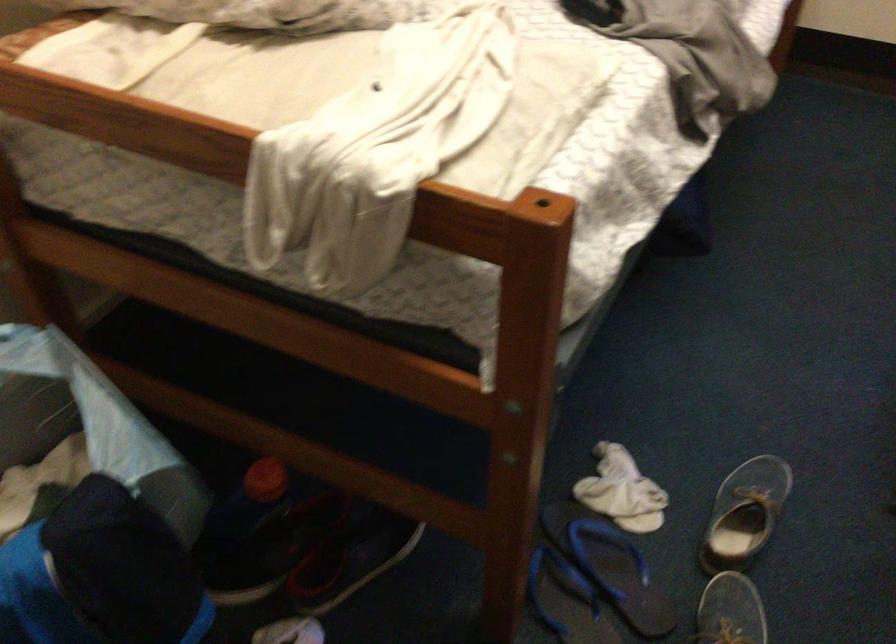
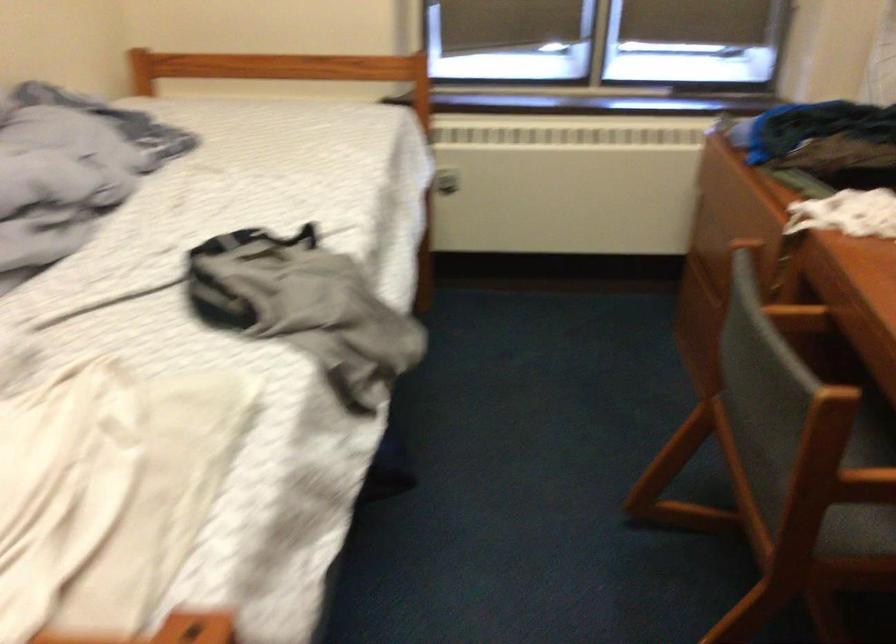
In a continuous first-person perspective shot, in which direction is the camera moving?

The movement direction of the cameraman is right, forward.